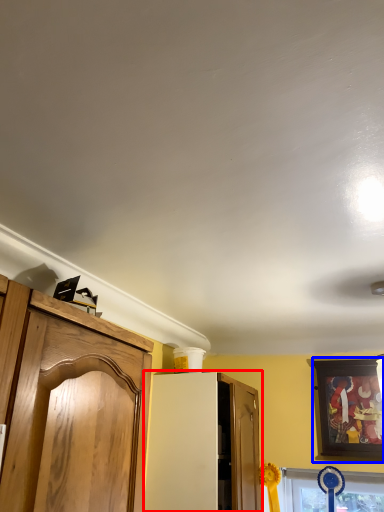
Question: Among these objects, which one is nearest to the camera, cabinetry (highlighted by a red box) or picture frame (highlighted by a blue box)?

Choices:
 (A) cabinetry
 (B) picture frame

Answer: (A)